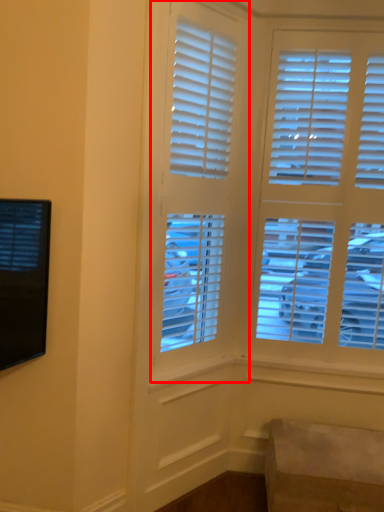
Question: From the image's perspective, considering the relative positions of window (annotated by the red box) and furniture in the image provided, where is window (annotated by the red box) located with respect to the staircase?

Choices:
 (A) below
 (B) above

Answer: (B)